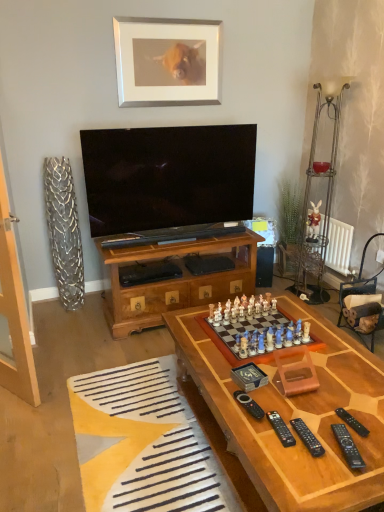
Question: Is white radiator at right in front of or behind black plastic remote at lower right, which ranks as the 3th remote in right-to-left order, in the image?

Choices:
 (A) behind
 (B) front

Answer: (A)

Question: Is white radiator at right taller or shorter than black plastic remote at lower right, which ranks as the 3th remote in right-to-left order?

Choices:
 (A) short
 (B) tall

Answer: (B)

Question: Based on their relative distances, which object is farther from the yellow fabric rug at lower left?

Choices:
 (A) wooden chess set at center
 (B) wooden chessboard at center
 (C) wooden armchair at right
 (D) silver/metallic picture frame at upper center
 (E) black plastic remote at lower right, the fourth remote when ordered from left to right

Answer: (D)

Question: Which is nearer to the wooden chess set at center?

Choices:
 (A) white radiator at right
 (B) black plastic remote at center, which ranks as the 5th remote in right-to-left order
 (C) white ceramic rabbit at right
 (D) silver/metallic picture frame at upper center
 (E) black plastic remote at lower right, which appears as the 5th remote when viewed from the left

Answer: (B)